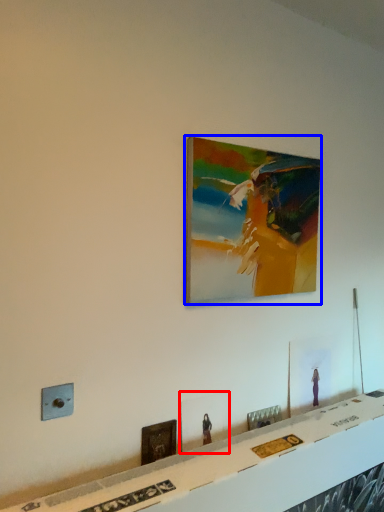
Question: Which object is further to the camera taking this photo, picture frame (highlighted by a red box) or picture frame (highlighted by a blue box)?

Choices:
 (A) picture frame
 (B) picture frame

Answer: (A)